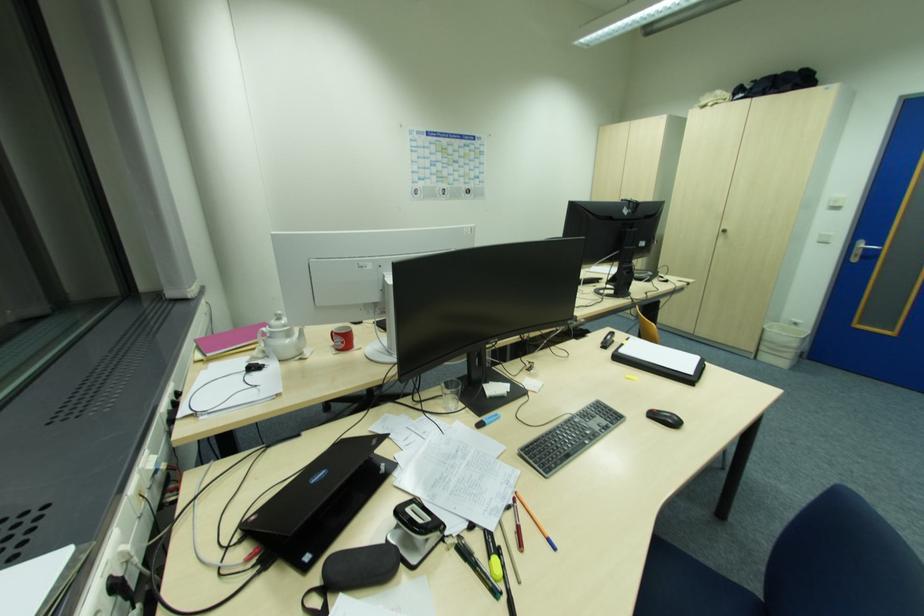
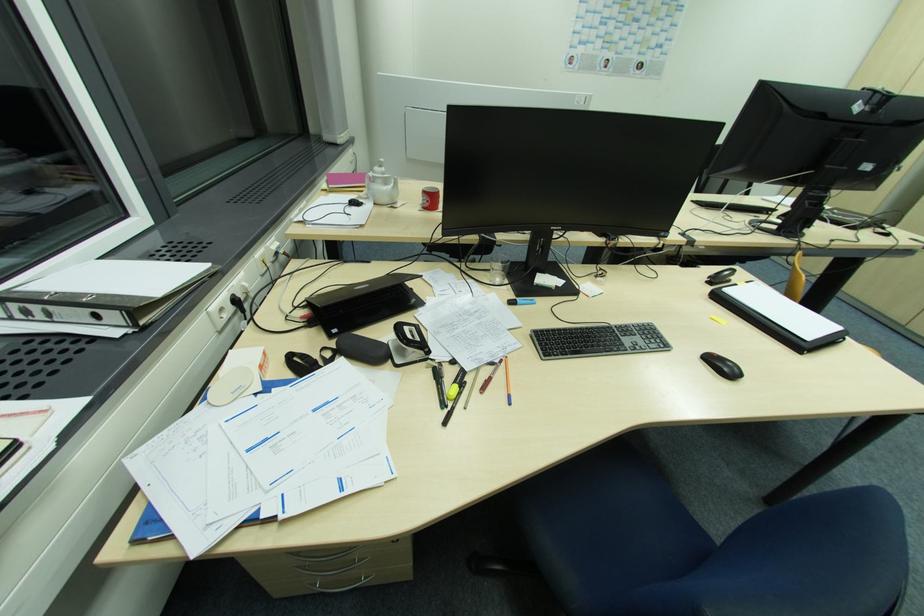
Locate, in the second image, the point that corresponds to point (344, 344) in the first image.

(430, 203)